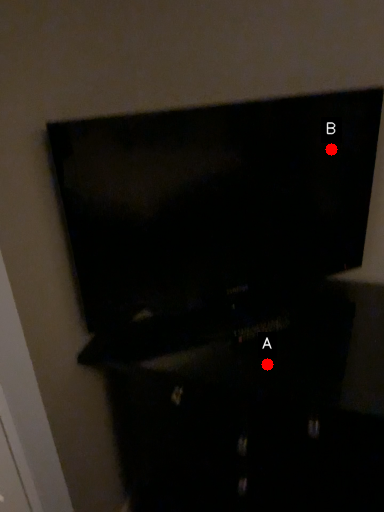
Question: Two points are circled on the image, labeled by A and B beside each circle. Which point is further to the camera?

Choices:
 (A) A is further
 (B) B is further

Answer: (B)